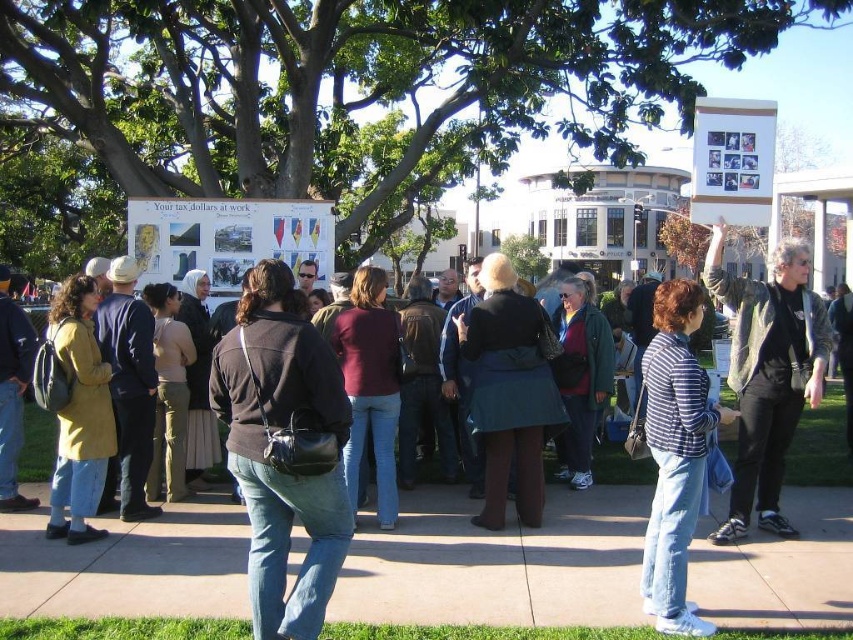
You are at the outdoor gathering and see the dark brown leather jacket at center and the gray leather jacket at center. Which one is positioned more to the left?

The dark brown leather jacket at center is positioned to the left of the gray leather jacket at center, so it is more to the left.

You are at an outdoor event and see two people wearing a dark brown leather jacket at center and a striped cotton shirt at center. Which person is closer to you?

The dark brown leather jacket at center is in front of the striped cotton shirt at center, so the person wearing the dark brown leather jacket at center is closer to you.

You are standing at the origin point of the image. Which direction should you move to reach the dark brown leather jacket at center?

The dark brown leather jacket at center is located at coordinates point (267, 444), so you should move to the right and slightly upwards to reach it.